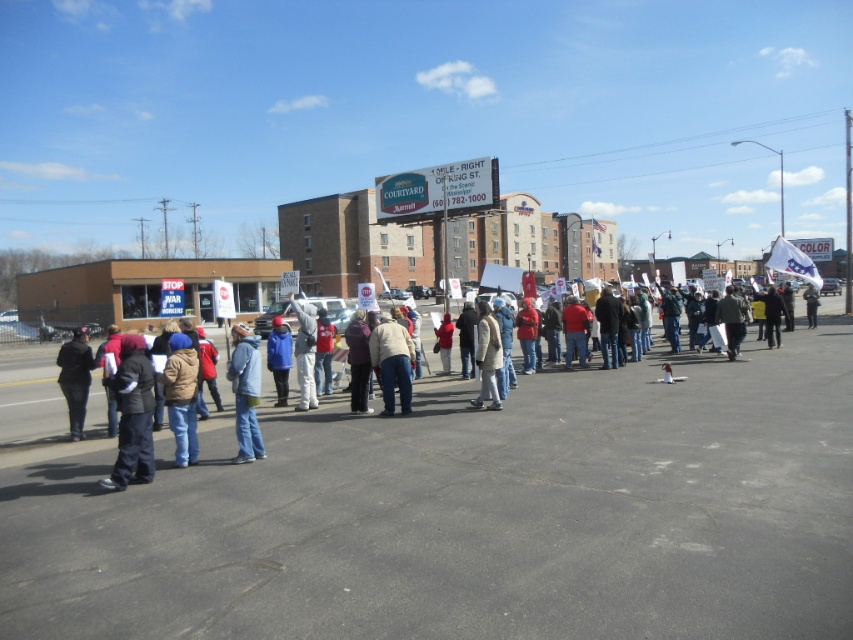
You are a photographer trying to capture both the black leather jacket at left and the blue fleece jacket at center in a single shot. Based on their positions, which jacket should you adjust your camera angle to focus on first to ensure both are in frame?

The black leather jacket at left is to the left of blue fleece jacket at center. To capture both in a single shot, you should adjust your camera angle to focus on the blue fleece jacket at center first, as it is positioned to the right of the black leather jacket at left, allowing you to frame both by expanding the view from the center outward.

In the scene shown: You are a photographer trying to capture a photo of the protest. You notice two people wearing dark blue jeans at left and dark blue jeans at center. If you want to focus on the person at the center, should you adjust your camera to include the person at the left in the frame?

The dark blue jeans at left is in front of dark blue jeans at center, so adjusting the camera to exclude the person at the left would allow focusing on the person at the center without obstruction.

You are organizing a photo shoot and need to place two models wearing the brown fuzzy jacket at lower left and the light beige sweater at center in a way that their outfits are clearly visible. Considering their widths, where should each model stand to ensure their clothing details are not obscured?

The brown fuzzy jacket at lower left is narrower than the light beige sweater at center. To ensure visibility, place the model in the brown fuzzy jacket at lower left closer to the camera and the model in the light beige sweater at center slightly farther back so their wider garment remains visible without obstruction.